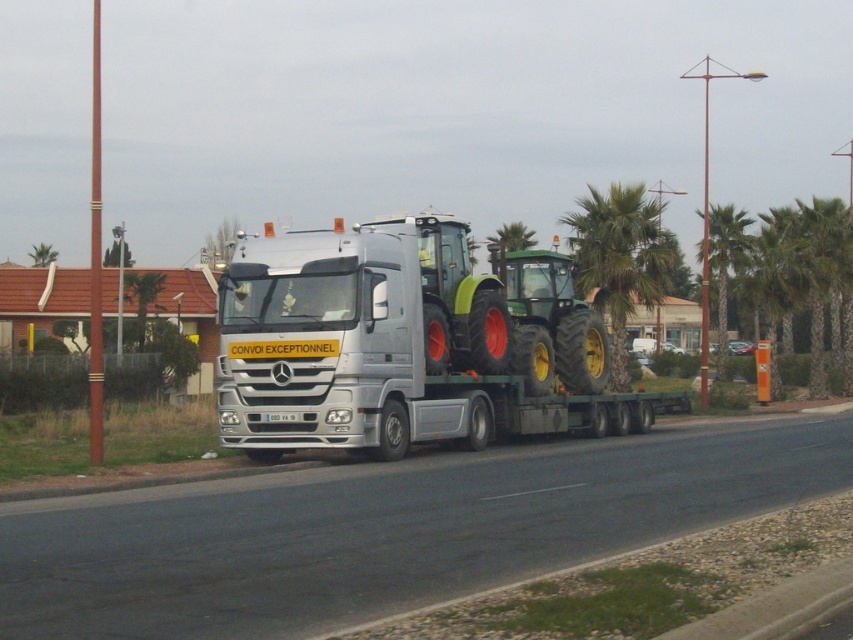
Question: Among these points, which one is farthest from the camera?

Choices:
 (A) pos(635,220)
 (B) pos(701,212)

Answer: (B)

Question: Is silver metallic truck at center below green leafy palm tree at right?

Choices:
 (A) yes
 (B) no

Answer: (A)

Question: Can you confirm if silver metallic truck at center is positioned below green leafy palm tree at right?

Choices:
 (A) yes
 (B) no

Answer: (A)

Question: In this image, where is silver metallic truck at center located relative to green leafy palm tree at center?

Choices:
 (A) right
 (B) left

Answer: (B)

Question: Which point is closer to the camera?

Choices:
 (A) (750, 244)
 (B) (322, 390)

Answer: (B)

Question: Which object is positioned farthest from the silver metallic truck at center?

Choices:
 (A) green leafy palm tree at center
 (B) green leafy palm tree at right

Answer: (B)